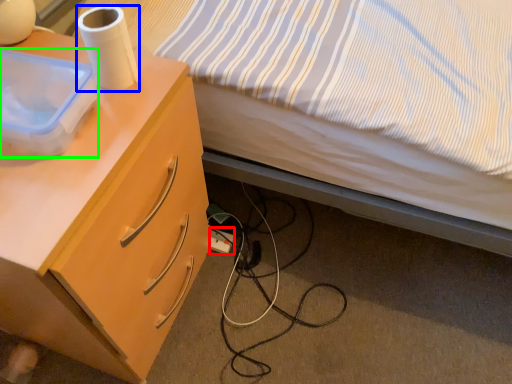
Question: Considering the real-world distances, which object is farthest from power outlet (highlighted by a red box)? paper towel (highlighted by a blue box) or box (highlighted by a green box)?

Choices:
 (A) paper towel
 (B) box

Answer: (B)